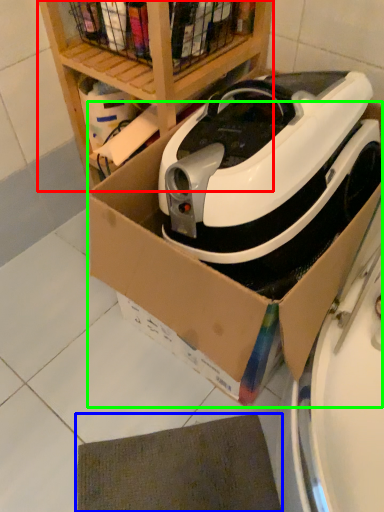
Question: Based on their relative distances, which object is farther from shelf (highlighted by a red box)? Choose from mat (highlighted by a blue box) and cardboard box (highlighted by a green box).

Choices:
 (A) mat
 (B) cardboard box

Answer: (A)